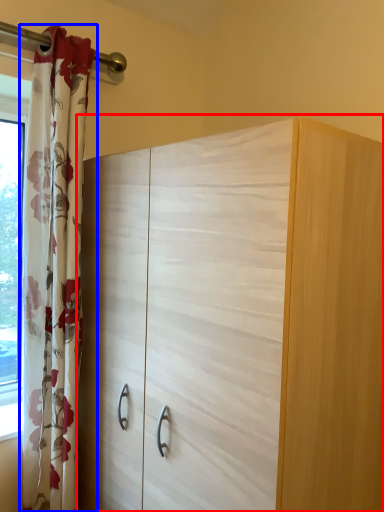
Question: Which point is closer to the camera, cupboard (highlighted by a red box) or curtain (highlighted by a blue box)?

Choices:
 (A) cupboard
 (B) curtain

Answer: (A)